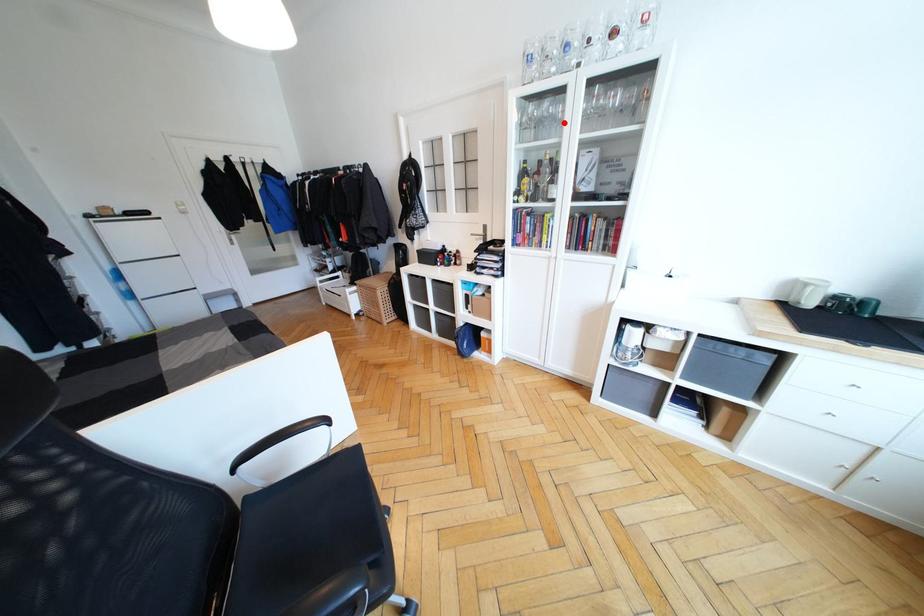
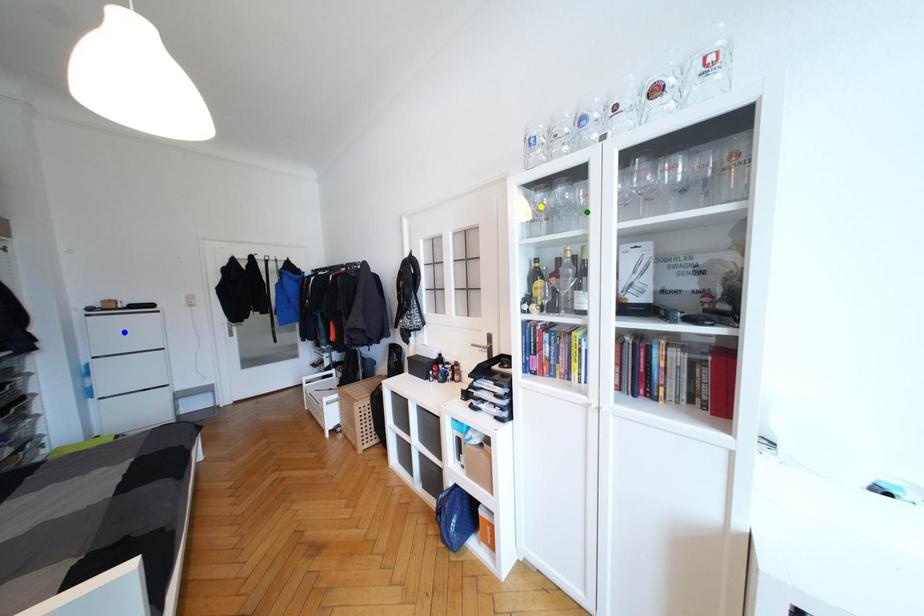
Question: I am providing you with two images of the same scene from different viewpoints. A red point is marked on the first image. You are given multiple points on the second image. In image 2, which mark is for the same physical point as the one in image 1?

Choices:
 (A) yellow point
 (B) green point
 (C) blue point

Answer: (B)